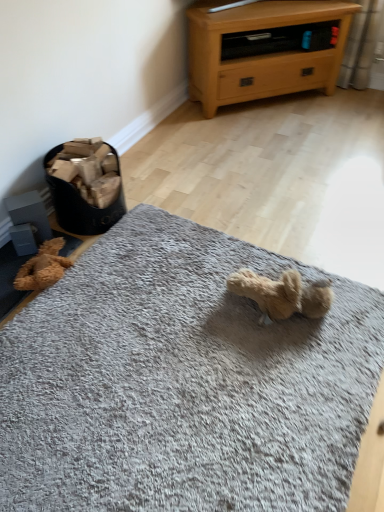
Question: Would you consider light oak wood chest of drawers at upper right to be distant from gray soft rug at center?

Choices:
 (A) no
 (B) yes

Answer: (B)

Question: Does light oak wood chest of drawers at upper right appear on the right side of gray soft rug at center?

Choices:
 (A) no
 (B) yes

Answer: (B)

Question: Can we say light oak wood chest of drawers at upper right lies outside gray soft rug at center?

Choices:
 (A) no
 (B) yes

Answer: (B)

Question: Can you confirm if light oak wood chest of drawers at upper right is smaller than gray soft rug at center?

Choices:
 (A) no
 (B) yes

Answer: (A)

Question: From the image's perspective, is light oak wood chest of drawers at upper right under gray soft rug at center?

Choices:
 (A) yes
 (B) no

Answer: (B)

Question: Is brown plush teddy bear at lower left in front of or behind gray soft rug at center in the image?

Choices:
 (A) behind
 (B) front

Answer: (A)

Question: Looking at their shapes, would you say brown plush teddy bear at lower left is wider or thinner than gray soft rug at center?

Choices:
 (A) thin
 (B) wide

Answer: (A)

Question: From the image's perspective, is brown plush teddy bear at lower left located above or below gray soft rug at center?

Choices:
 (A) below
 (B) above

Answer: (B)

Question: Visually, is brown plush teddy bear at lower left positioned to the left or to the right of gray soft rug at center?

Choices:
 (A) right
 (B) left

Answer: (B)

Question: From a real-world perspective, is brown plush teddy bear at lower left physically located above or below light oak wood chest of drawers at upper right?

Choices:
 (A) below
 (B) above

Answer: (A)

Question: Relative to light oak wood chest of drawers at upper right, is brown plush teddy bear at lower left in front or behind?

Choices:
 (A) front
 (B) behind

Answer: (A)

Question: Do you think brown plush teddy bear at lower left is within light oak wood chest of drawers at upper right, or outside of it?

Choices:
 (A) outside
 (B) inside

Answer: (A)

Question: In terms of width, does brown plush teddy bear at lower left look wider or thinner when compared to light oak wood chest of drawers at upper right?

Choices:
 (A) thin
 (B) wide

Answer: (A)

Question: In the image, is gray soft rug at center on the left side or the right side of light oak wood chest of drawers at upper right?

Choices:
 (A) left
 (B) right

Answer: (A)

Question: Relative to light oak wood chest of drawers at upper right, is gray soft rug at center in front or behind?

Choices:
 (A) front
 (B) behind

Answer: (A)